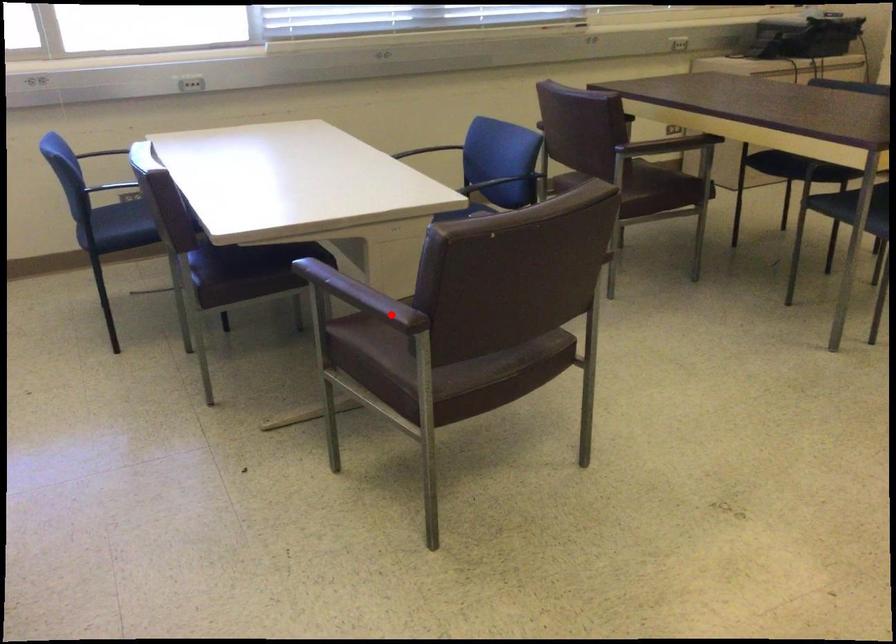
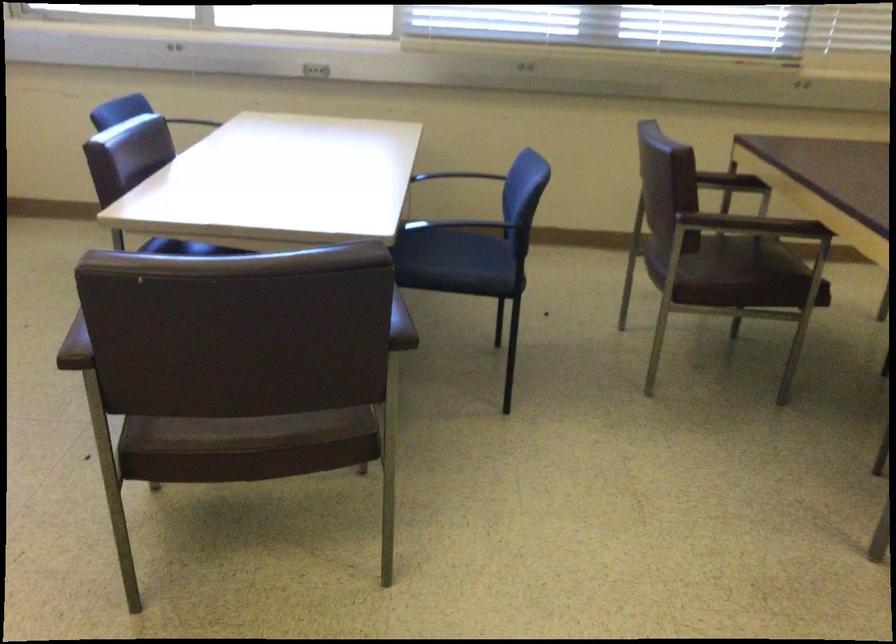
Find the pixel in the second image that matches the highlighted location in the first image.

(75, 346)